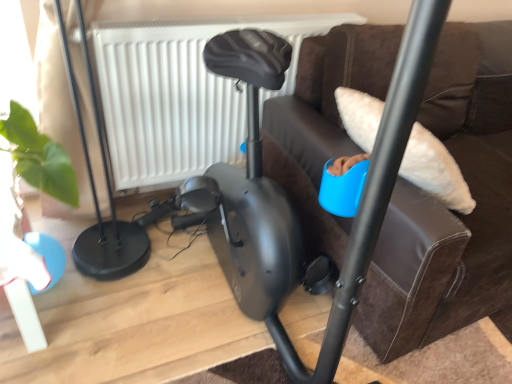
This screenshot has height=384, width=512. In order to click on free space in front of white textured radiator at upper center in this screenshot , I will do `click(164, 299)`.